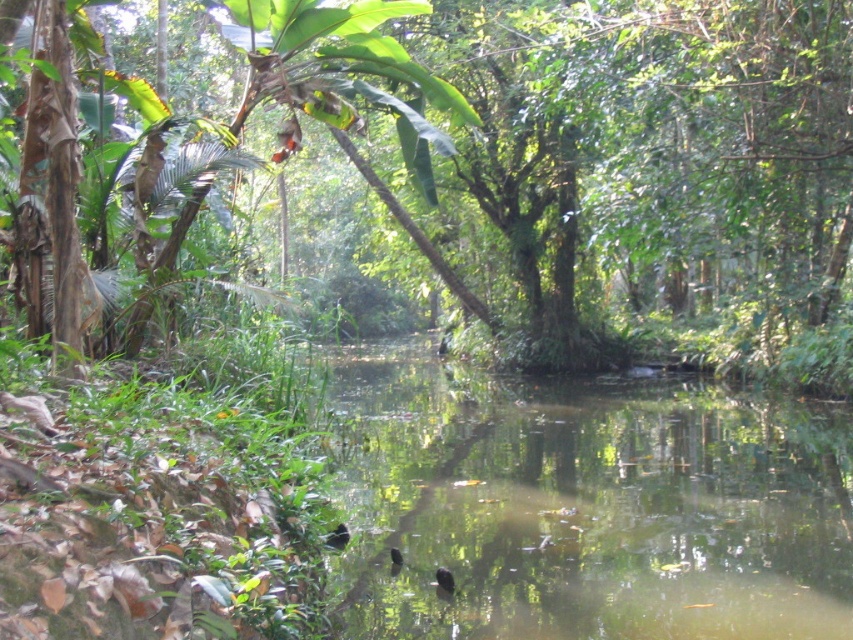
You are a hiker who wants to cross the green reflective water at center using the green leafy tree at center as a bridge. Can you safely step from the tree to the water?

The green reflective water at center is to the left of green leafy tree at center, so you can safely step from the green leafy tree at center to the green reflective water at center since they are positioned next to each other.

Looking at this image, you are a hiker trying to cross the green reflective water at center. There is a fallen log from the green leafy tree at center that you can use as a bridge. Will the log be long enough to span the water?

The green reflective water at center has a lesser width compared to green leafy tree at center, so the log from the green leafy tree at center should be long enough to span the water since the tree is wider than the water.

You are navigating a small boat through the jungle and need to reach the green reflective water at center. Based on the coordinates provided, is the water located closer to the top or bottom of the image?

The green reflective water at center is located at coordinates point (583, 506). Since the y coordinate 0.685 is closer to 1.0, it is positioned closer to the bottom of the image.